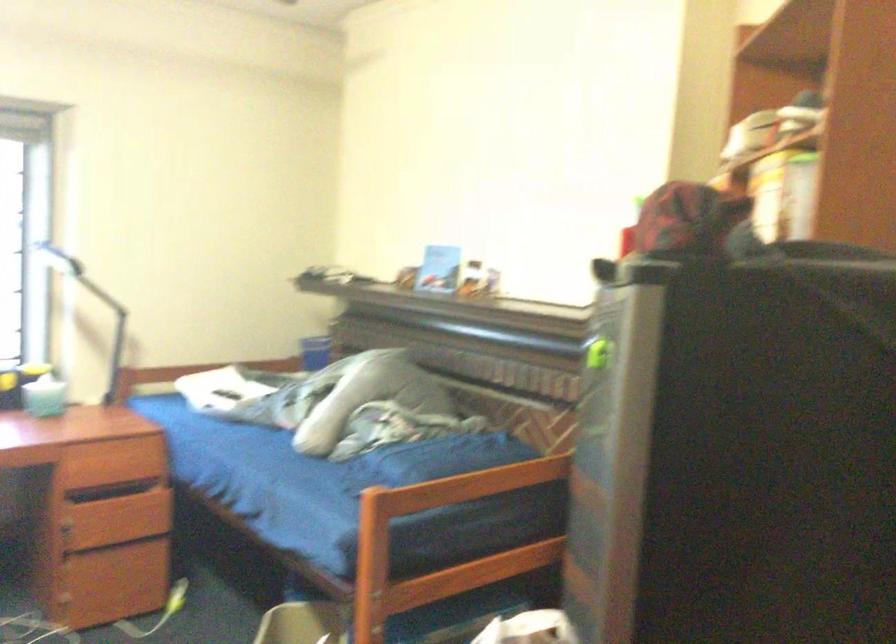
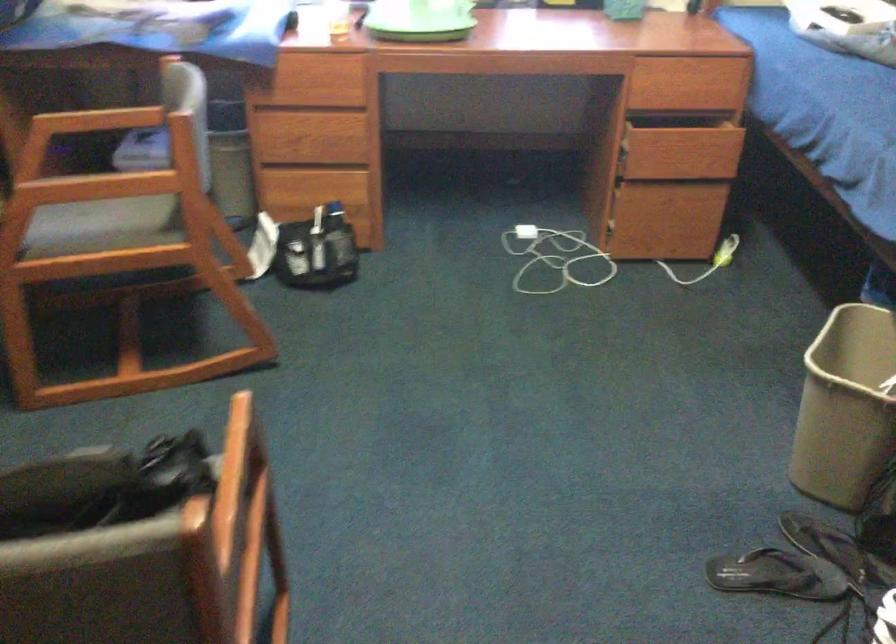
The first image is from the beginning of the video and the second image is from the end. How did the camera likely rotate when shooting the video?

The camera rotated toward left-down.